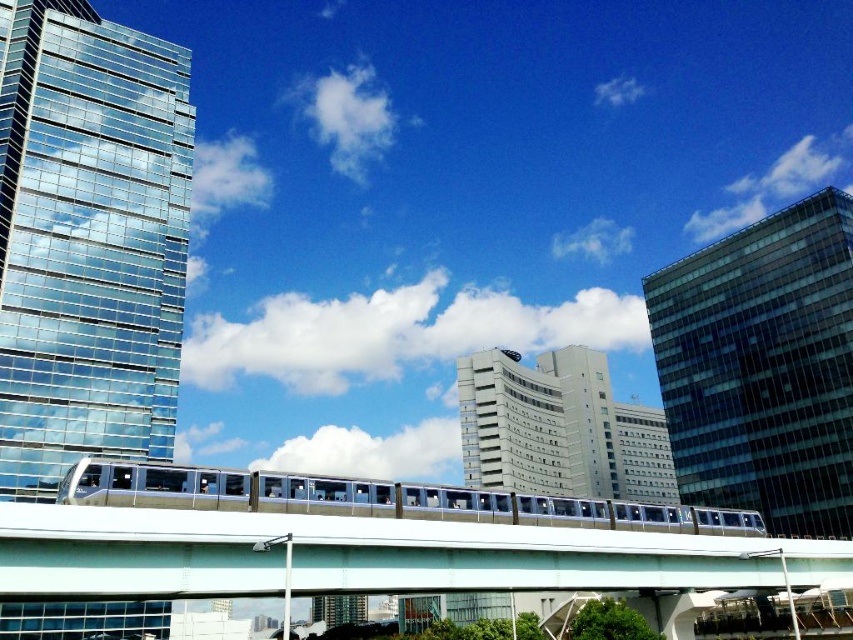
Question: Is white smooth building at center positioned at the back of silver metallic train at center?

Choices:
 (A) yes
 (B) no

Answer: (A)

Question: Which object is positioned closest to the silver metallic train at center?

Choices:
 (A) white glossy overpass at center
 (B) glassy reflective skyscraper at right
 (C) transparent glass skyscraper at left

Answer: (A)

Question: Is glassy reflective skyscraper at right above white smooth building at center?

Choices:
 (A) no
 (B) yes

Answer: (B)

Question: Among these points, which one is nearest to the camera?

Choices:
 (A) (103, 499)
 (B) (575, 403)
 (C) (70, 244)
 (D) (840, 275)

Answer: (A)

Question: Can you confirm if white glossy overpass at center is positioned below silver metallic train at center?

Choices:
 (A) yes
 (B) no

Answer: (A)

Question: Which point appears closest to the camera in this image?

Choices:
 (A) (171, 545)
 (B) (750, 256)
 (C) (273, 488)

Answer: (A)